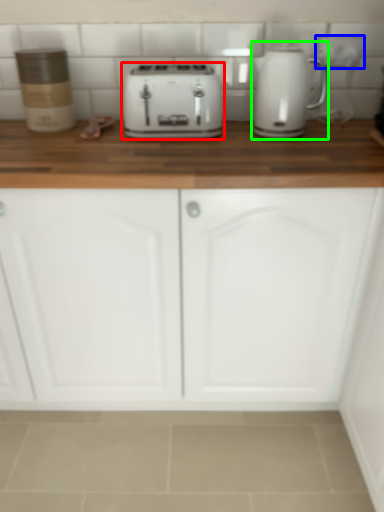
Question: Which object is the farthest from toaster (highlighted by a red box)? Choose among these: electric outlet (highlighted by a blue box) or home appliance (highlighted by a green box).

Choices:
 (A) electric outlet
 (B) home appliance

Answer: (A)